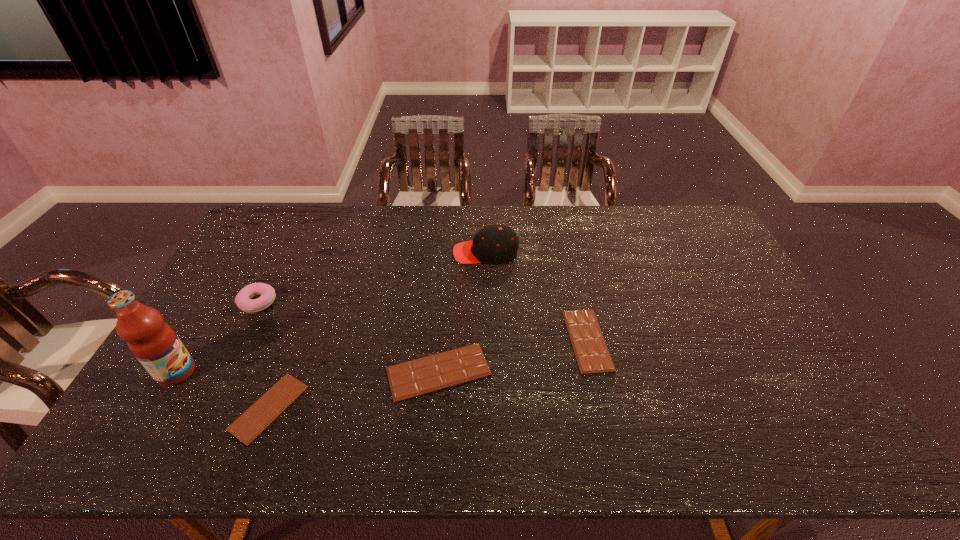
Identify the location of the shortest object. Image resolution: width=960 pixels, height=540 pixels. (247, 427).

Where is `the fourth object from right to left`? The image size is (960, 540). the fourth object from right to left is located at coordinates (247, 427).

Locate an element on the screen. Image resolution: width=960 pixels, height=540 pixels. the second chocolate bar from right to left is located at coordinates (432, 373).

Locate an element on the screen. This screenshot has height=540, width=960. the rightmost chocolate bar is located at coordinates 591,352.

Identify the location of the rightmost object. (591, 352).

The width and height of the screenshot is (960, 540). I want to click on cap, so click(493, 244).

This screenshot has height=540, width=960. In order to click on the second tallest object in this screenshot , I will do `click(493, 244)`.

This screenshot has width=960, height=540. I want to click on the tallest object, so click(153, 342).

The height and width of the screenshot is (540, 960). In order to click on fruit juice in this screenshot , I will do `click(153, 342)`.

Identify the location of the second object from left to right. (243, 300).